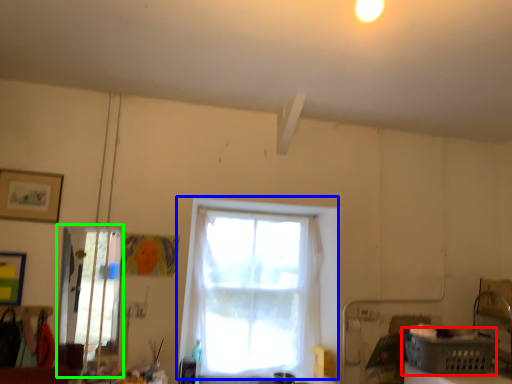
Question: Which object is positioned closest to basket (highlighted by a red box)? Select from window (highlighted by a blue box) and glass door (highlighted by a green box).

Choices:
 (A) window
 (B) glass door

Answer: (A)